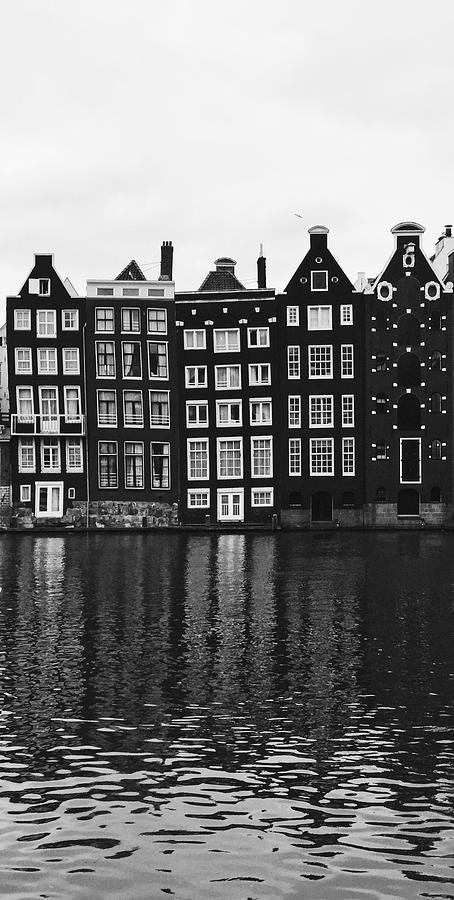
At what (x,y) coordinates should I click in order to perform the action: click on chimney. Please return your answer as a coordinate pair (x, y). The height and width of the screenshot is (900, 454). Looking at the image, I should click on (166, 255), (261, 261), (447, 230).